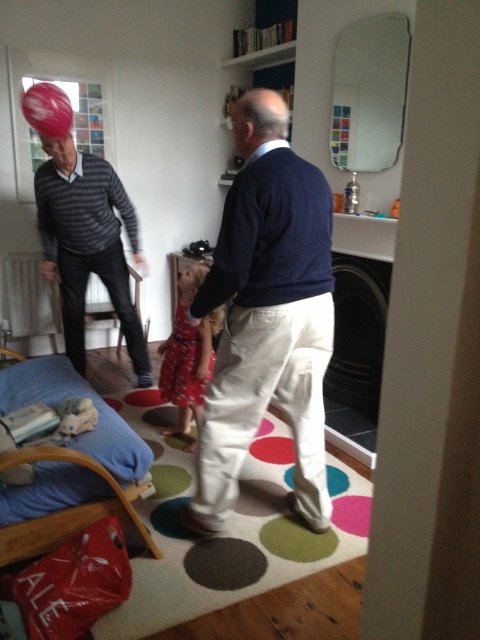
You are a photographer setting up a shoot in this room. You want to position a small lamp between the red dress at center and the smooth bald head at center. Based on their positions, where should you place the lamp?

The red dress at center is below the smooth bald head at center, so you should place the lamp between them horizontally since the lamp needs to be positioned in the space between their horizontal positions.

You are a photographer trying to capture a candid shot of the smooth bald head at center without including the matte black sweater at left in the frame. Given their relative heights, can you position yourself in a way to achieve this?

The matte black sweater at left is taller than smooth bald head at center. To avoid including the taller matte black sweater at left in the photo, position yourself lower so that the shorter smooth bald head at center is framed above the sweater.